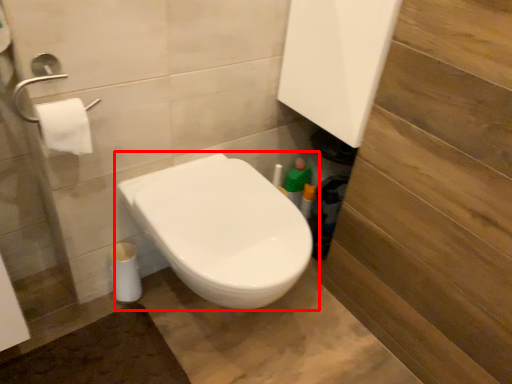
Question: Observing the image, what is the correct spatial positioning of toilet (annotated by the red box) in reference to toilet paper?

Choices:
 (A) left
 (B) right

Answer: (B)